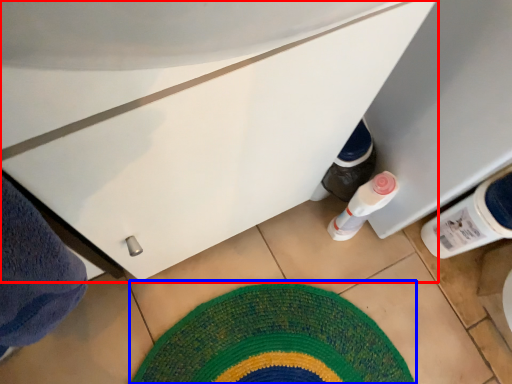
Question: Which of the following is the farthest to the observer, cabinetry (highlighted by a red box) or mat (highlighted by a blue box)?

Choices:
 (A) cabinetry
 (B) mat

Answer: (B)